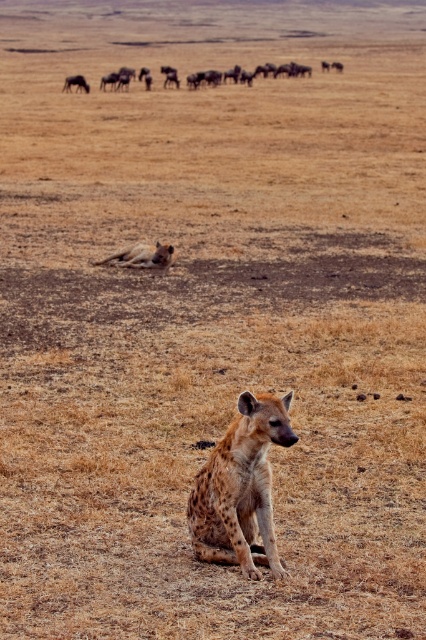
Is spotted fur hyaena at center positioned in front of spotted hyena at center?

Yes.

Is point (206, 477) behind point (117, 81)?

No, (206, 477) is closer to viewer.

Where is `spotted fur hyaena at center`? Image resolution: width=426 pixels, height=640 pixels. spotted fur hyaena at center is located at coordinates (241, 488).

Does brown textured herd at upper center lie in front of spotted hyena at center?

Yes, brown textured herd at upper center is closer to the viewer.

Can you confirm if brown textured herd at upper center is thinner than spotted hyena at center?

No.

Locate an element on the screen. This screenshot has height=640, width=426. brown textured herd at upper center is located at coordinates (250, 74).

Where is `brown textured herd at upper center`? brown textured herd at upper center is located at coordinates (250, 74).

Who is shorter, spotted fur hyaena at center or spotted fur hyena at center?

spotted fur hyena at center

Measure the distance between point (256, 545) and camera.

4.69 meters

Find the location of a particular element. This screenshot has width=426, height=640. spotted fur hyaena at center is located at coordinates 241,488.